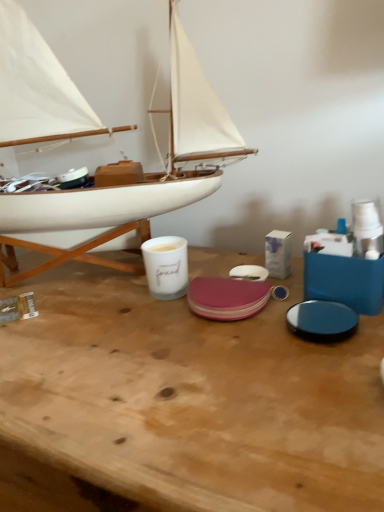
At what (x,y) coordinates should I click in order to perform the action: click on free space to the back side of white ceramic mug at center. Please return your answer as a coordinate pair (x, y). Looking at the image, I should click on (187, 264).